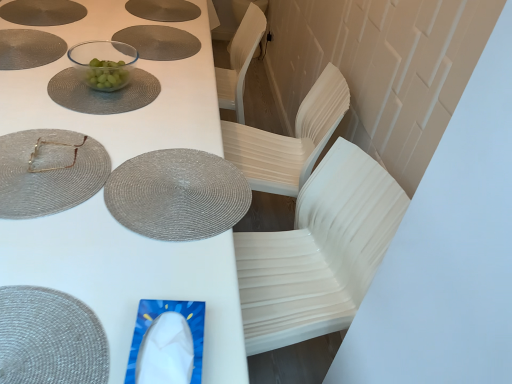
In order to click on free space between matte gray placemat at upper left, the first plate from the left, and matte gray placemat at upper center, which appears as the first plate when viewed from the right in this screenshot , I will do `click(85, 44)`.